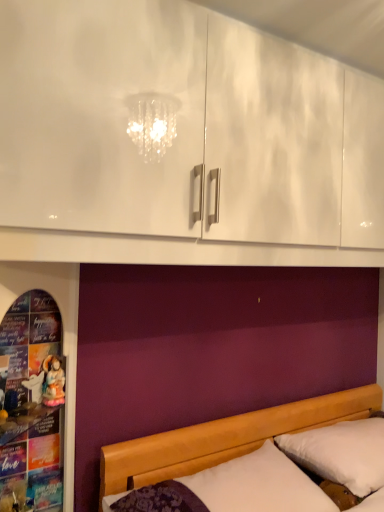
You are a GUI agent. You are given a task and a screenshot of the screen. Output one action in this format:
    pyautogui.click(x=<x>, y=<y>)
    Task: Click on the white soft pillow at lower right
    The height and width of the screenshot is (512, 384).
    Given the screenshot: What is the action you would take?
    pyautogui.click(x=341, y=453)

This screenshot has width=384, height=512. Find the location of `matte porcelain doll at left`. matte porcelain doll at left is located at coordinates (53, 381).

From a real-world perspective, is matte porcelain doll at left under white soft pillow at lower right?

No, from a real-world perspective, matte porcelain doll at left is not under white soft pillow at lower right.

From the image's perspective, is matte porcelain doll at left located above or below white soft pillow at lower right?

Based on their image positions, matte porcelain doll at left is located above white soft pillow at lower right.

Is matte porcelain doll at left positioned far away from white soft pillow at lower right?

matte porcelain doll at left is positioned a significant distance from white soft pillow at lower right.

In terms of size, does wooden bed at lower right appear bigger or smaller than white soft pillow at lower right?

wooden bed at lower right is bigger than white soft pillow at lower right.

Identify the location of pillow lying behind the wooden bed at lower right. This screenshot has width=384, height=512. (341, 453).

How different are the orientations of wooden bed at lower right and white soft pillow at lower right in degrees?

The angle between the facing direction of wooden bed at lower right and the facing direction of white soft pillow at lower right is 0.354 degrees.

From the image's perspective, between wooden bed at lower right and white soft pillow at lower right, who is located below?

wooden bed at lower right is shown below in the image.

Would you say matte porcelain doll at left is part of white soft pillow at lower right's contents?

No, matte porcelain doll at left is located outside of white soft pillow at lower right.

Is point (282, 451) positioned in front of point (54, 379)?

No.

Is white soft pillow at lower right thinner than matte porcelain doll at left?

Incorrect, the width of white soft pillow at lower right is not less than that of matte porcelain doll at left.

Is white soft pillow at lower right smaller than matte porcelain doll at left?

Actually, white soft pillow at lower right might be larger than matte porcelain doll at left.

Consider the image. Would you say wooden bed at lower right is outside matte porcelain doll at left?

wooden bed at lower right lies outside matte porcelain doll at left's area.

Considering their positions, is wooden bed at lower right located in front of or behind matte porcelain doll at left?

wooden bed at lower right is positioned closer to the viewer than matte porcelain doll at left.

In the scene shown: How much distance is there between wooden bed at lower right and matte porcelain doll at left?

wooden bed at lower right is 66.37 centimeters from matte porcelain doll at left.

Is white soft pillow at lower right in contact with wooden bed at lower right?

No, white soft pillow at lower right is not with wooden bed at lower right.

Which object is wider, white soft pillow at lower right or wooden bed at lower right?

With larger width is wooden bed at lower right.

Is white soft pillow at lower right to the right of wooden bed at lower right from the viewer's perspective?

Yes.

Between white soft pillow at lower right and wooden bed at lower right, which one has smaller size?

Smaller between the two is white soft pillow at lower right.

Is wooden bed at lower right at the back of matte porcelain doll at left?

No, matte porcelain doll at left is not facing away from wooden bed at lower right.

Can you confirm if matte porcelain doll at left is bigger than wooden bed at lower right?

Incorrect, matte porcelain doll at left is not larger than wooden bed at lower right.

Which is more to the left, matte porcelain doll at left or wooden bed at lower right?

matte porcelain doll at left is more to the left.

Is matte porcelain doll at left situated inside wooden bed at lower right or outside?

matte porcelain doll at left is outside wooden bed at lower right.

Find the location of a particular element. This screenshot has height=512, width=384. pillow that appears below the matte porcelain doll at left (from the image's perspective) is located at coordinates (341, 453).

At what (x,y) coordinates should I click in order to perform the action: click on bed below the white soft pillow at lower right (from a real-world perspective). Please return your answer as a coordinate pair (x, y). Looking at the image, I should click on (223, 439).

Based on the photo, when comparing their distances from white soft pillow at lower right, does wooden bed at lower right or matte porcelain doll at left seem closer?

wooden bed at lower right is closer to white soft pillow at lower right.

When comparing their distances from wooden bed at lower right, does matte porcelain doll at left or white soft pillow at lower right seem further?

matte porcelain doll at left lies further to wooden bed at lower right than the other object.

Looking at the image, which one is located further to wooden bed at lower right, white soft pillow at lower right or matte porcelain doll at left?

Among the two, matte porcelain doll at left is located further to wooden bed at lower right.

Consider the image. Which object lies further to the anchor point matte porcelain doll at left, white soft pillow at lower right or wooden bed at lower right?

The object further to matte porcelain doll at left is white soft pillow at lower right.

Which object lies nearer to the anchor point matte porcelain doll at left, wooden bed at lower right or white soft pillow at lower right?

wooden bed at lower right.

Based on the photo, looking at the image, which one is located further to white soft pillow at lower right, matte porcelain doll at left or wooden bed at lower right?

matte porcelain doll at left is further to white soft pillow at lower right.

This screenshot has height=512, width=384. I want to click on bed between matte porcelain doll at left and white soft pillow at lower right from left to right, so click(223, 439).